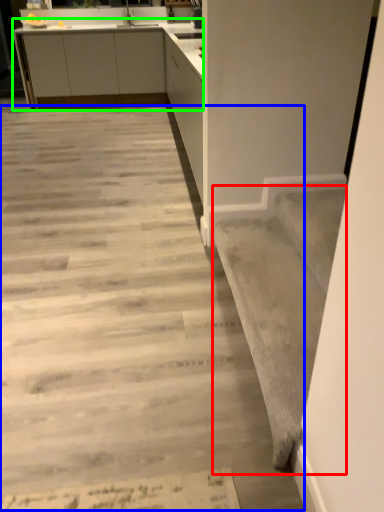
Question: Which object is the farthest from stairwell (highlighted by a red box)? Choose among these: concrete (highlighted by a blue box) or cabinetry (highlighted by a green box).

Choices:
 (A) concrete
 (B) cabinetry

Answer: (B)